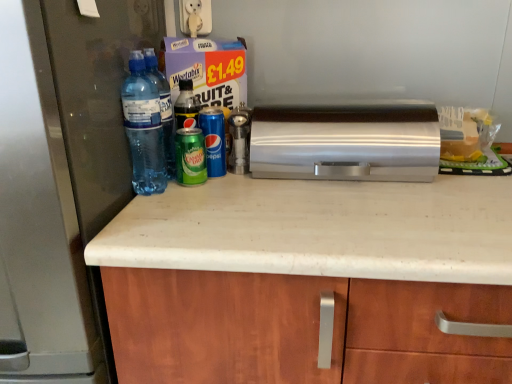
Question: Is blue metallic can at center, positioned as the third bottle in left-to-right order, taller than transparent plastic water bottles at left, the 1th bottle positioned from the left?

Choices:
 (A) yes
 (B) no

Answer: (B)

Question: Does blue metallic can at center, positioned as the third bottle in left-to-right order, contain transparent plastic water bottles at left, which is the third bottle from right to left?

Choices:
 (A) yes
 (B) no

Answer: (B)

Question: From a real-world perspective, is blue metallic can at center, positioned as the third bottle in left-to-right order, positioned over transparent plastic water bottles at left, which is the third bottle from right to left, based on gravity?

Choices:
 (A) no
 (B) yes

Answer: (A)

Question: Is blue metallic can at center, which is counted as the first bottle, starting from the right, outside transparent plastic water bottles at left, which is the third bottle from right to left?

Choices:
 (A) no
 (B) yes

Answer: (B)

Question: Considering the relative positions of blue metallic can at center, positioned as the third bottle in left-to-right order, and transparent plastic water bottles at left, which is the third bottle from right to left, in the image provided, is blue metallic can at center, positioned as the third bottle in left-to-right order, in front of transparent plastic water bottles at left, which is the third bottle from right to left,?

Choices:
 (A) yes
 (B) no

Answer: (B)

Question: Is blue metallic can at center, positioned as the third bottle in left-to-right order, not near transparent plastic water bottles at left, which is the third bottle from right to left?

Choices:
 (A) no
 (B) yes

Answer: (A)

Question: Could you tell me if matte black refrigerator at left is turned towards transparent plastic water bottles at left, the 1th bottle positioned from the left?

Choices:
 (A) yes
 (B) no

Answer: (B)

Question: From the image's perspective, is matte black refrigerator at left above transparent plastic water bottles at left, which is the third bottle from right to left?

Choices:
 (A) yes
 (B) no

Answer: (B)

Question: Does matte black refrigerator at left contain transparent plastic water bottles at left, the 1th bottle positioned from the left?

Choices:
 (A) no
 (B) yes

Answer: (A)

Question: Does matte black refrigerator at left appear on the right side of transparent plastic water bottles at left, the 1th bottle positioned from the left?

Choices:
 (A) yes
 (B) no

Answer: (B)

Question: From a real-world perspective, does matte black refrigerator at left sit lower than transparent plastic water bottles at left, the 1th bottle positioned from the left?

Choices:
 (A) no
 (B) yes

Answer: (B)

Question: Is matte black refrigerator at left positioned behind transparent plastic water bottles at left, the 1th bottle positioned from the left?

Choices:
 (A) no
 (B) yes

Answer: (A)

Question: From a real-world perspective, is silver metallic bread bin at center physically above blue metallic can at center, positioned as the third bottle in left-to-right order?

Choices:
 (A) no
 (B) yes

Answer: (B)